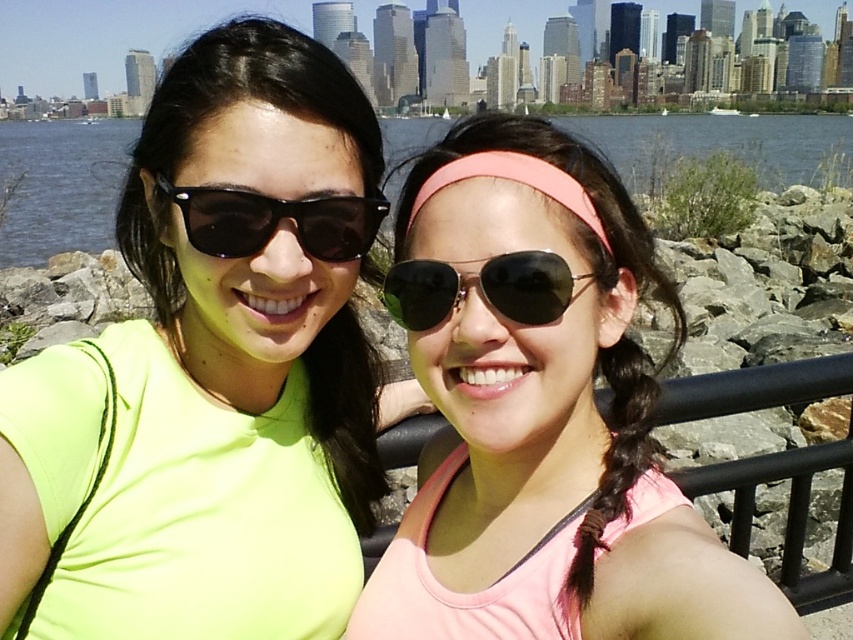
You are standing in the scene and want to place a small decorative item between the black metal rail at center and the metallic reflective sunglasses at center. Which object should the item be placed closer to if you want it to be nearer to the sunglasses?

The item should be placed closer to the metallic reflective sunglasses at center because the black metal rail at center is to the right of the metallic reflective sunglasses at center, meaning the sunglasses are to the left of the rail. Therefore, placing the item closer to the sunglasses would mean it is nearer to them rather than the rail.

You are a photographer trying to capture a closeup of both the black reflective sunglasses at left and the metallic reflective sunglasses at center. Since you can only focus on one object at a time, which one should you focus on first to ensure it appears sharp in the photo?

You should focus on the black reflective sunglasses at left first because it is closer to the viewer than the metallic reflective sunglasses at center, so focusing on the closer object will ensure it remains sharp.